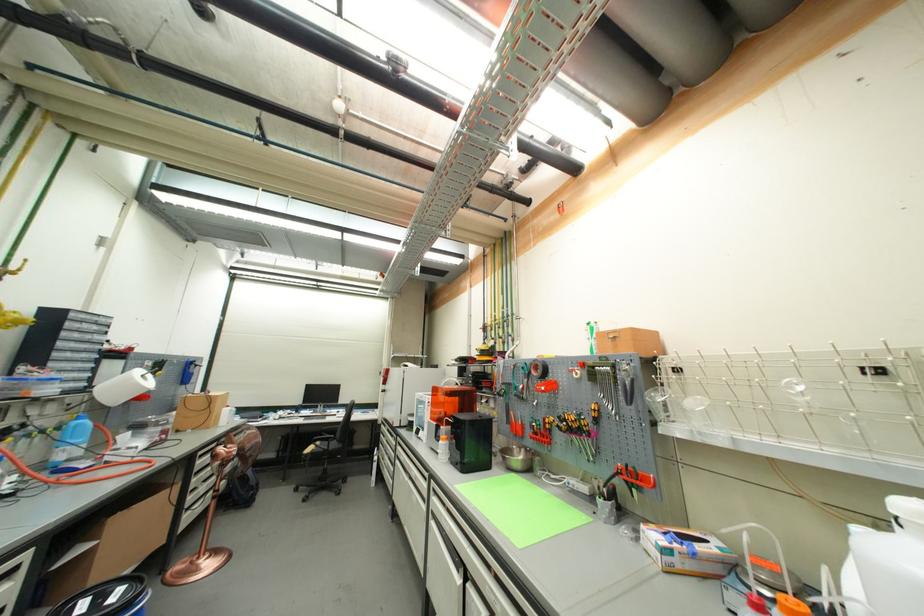
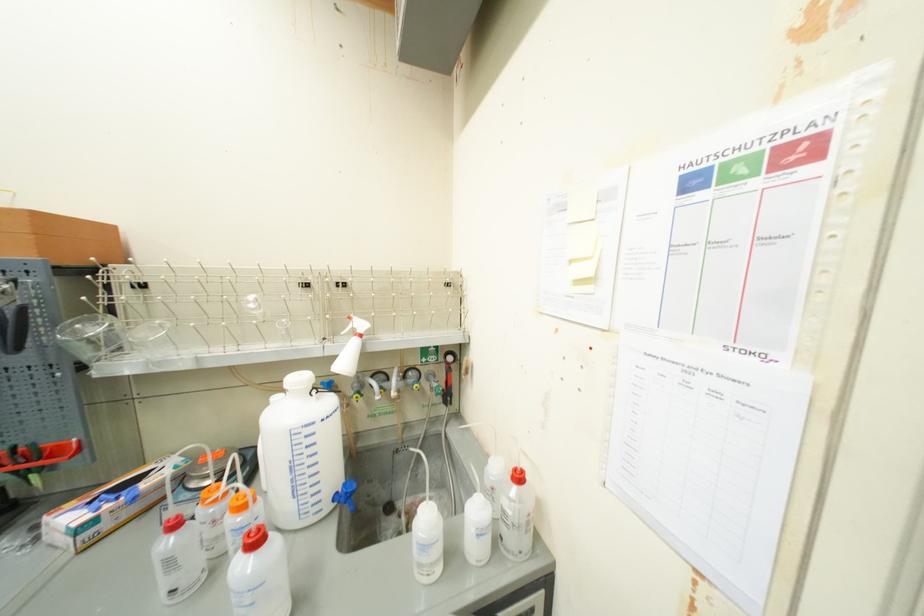
Question: The camera is either moving clockwise (left) or counter-clockwise (right) around the object. The first image is from the beginning of the video and the second image is from the end. Is the camera moving left or right when shooting the video?

Choices:
 (A) Left
 (B) Right

Answer: (A)